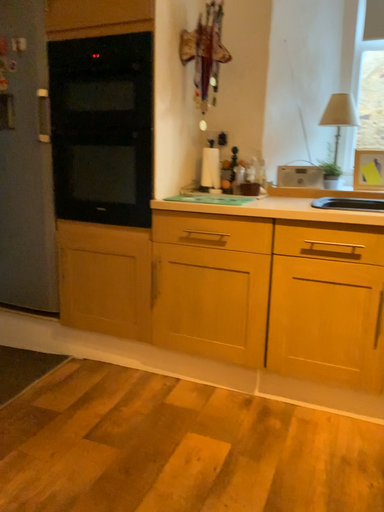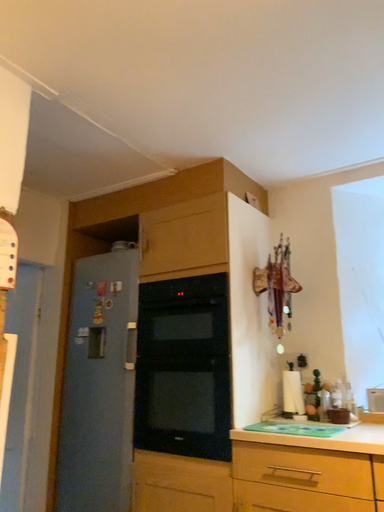
Question: How did the camera likely rotate when shooting the video?

Choices:
 (A) rotated right
 (B) rotated left

Answer: (B)